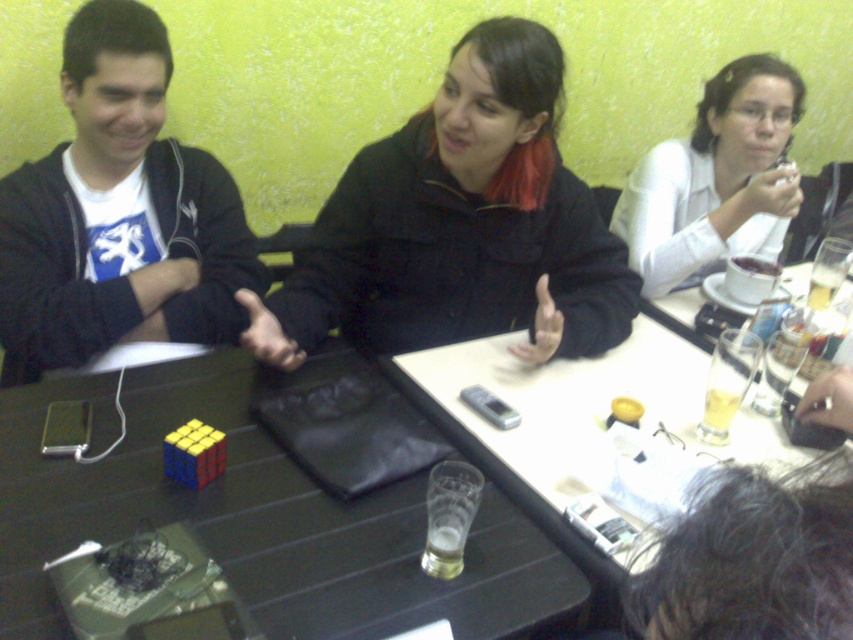
Question: Is the position of black matte jacket at center more distant than that of translucent glass beer at table center?

Choices:
 (A) no
 (B) yes

Answer: (B)

Question: Does black matte jacket at center have a larger size compared to translucent glass at table right?

Choices:
 (A) yes
 (B) no

Answer: (A)

Question: Which point is closer to the camera?

Choices:
 (A) black matte jacket at left
 (B) black matte jacket at center
 (C) translucent glass beer at table center
 (D) translucent glass at table right

Answer: (C)

Question: Considering the relative positions of white glossy shirt at upper right and translucent glass beer at table center in the image provided, where is white glossy shirt at upper right located with respect to translucent glass beer at table center?

Choices:
 (A) right
 (B) left

Answer: (A)

Question: Which of the following is the farthest from the observer?

Choices:
 (A) black leather bag at center
 (B) translucent glass beer at table center

Answer: (B)

Question: Estimate the real-world distances between objects in this image. Which object is closer to the black leather bag at center?

Choices:
 (A) white glossy shirt at upper right
 (B) black matte jacket at left

Answer: (B)